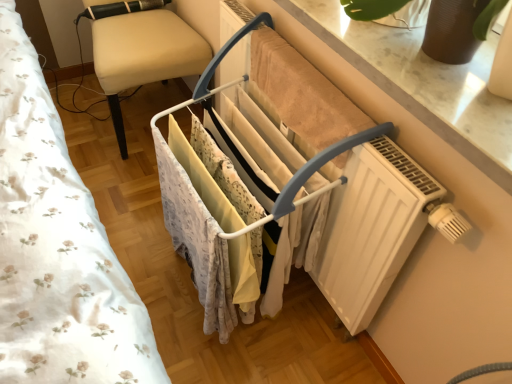
Question: Is beige fabric chair at left to the right of white matte clothes rack at center from the viewer's perspective?

Choices:
 (A) yes
 (B) no

Answer: (B)

Question: Is white matte clothes rack at center inside beige fabric chair at left?

Choices:
 (A) no
 (B) yes

Answer: (A)

Question: Is beige fabric chair at left looking in the opposite direction of white matte clothes rack at center?

Choices:
 (A) yes
 (B) no

Answer: (B)

Question: Is beige fabric chair at left completely or partially outside of white matte clothes rack at center?

Choices:
 (A) yes
 (B) no

Answer: (A)

Question: Considering the relative sizes of beige fabric chair at left and white matte clothes rack at center in the image provided, is beige fabric chair at left thinner than white matte clothes rack at center?

Choices:
 (A) no
 (B) yes

Answer: (A)

Question: Are beige fabric chair at left and white matte clothes rack at center making contact?

Choices:
 (A) no
 (B) yes

Answer: (A)

Question: From the image's perspective, would you say white floral fabric at left is positioned over beige fabric chair at left?

Choices:
 (A) yes
 (B) no

Answer: (B)

Question: Can you confirm if white floral fabric at left is smaller than beige fabric chair at left?

Choices:
 (A) no
 (B) yes

Answer: (B)

Question: Is white floral fabric at left behind beige fabric chair at left?

Choices:
 (A) no
 (B) yes

Answer: (A)

Question: From a real-world perspective, is white floral fabric at left located beneath beige fabric chair at left?

Choices:
 (A) no
 (B) yes

Answer: (A)

Question: Is white floral fabric at left at the right side of beige fabric chair at left?

Choices:
 (A) no
 (B) yes

Answer: (A)

Question: Does white floral fabric at left appear on the left side of beige fabric chair at left?

Choices:
 (A) no
 (B) yes

Answer: (B)

Question: Considering the relative sizes of beige fabric chair at left and white floral fabric at left in the image provided, is beige fabric chair at left smaller than white floral fabric at left?

Choices:
 (A) yes
 (B) no

Answer: (B)